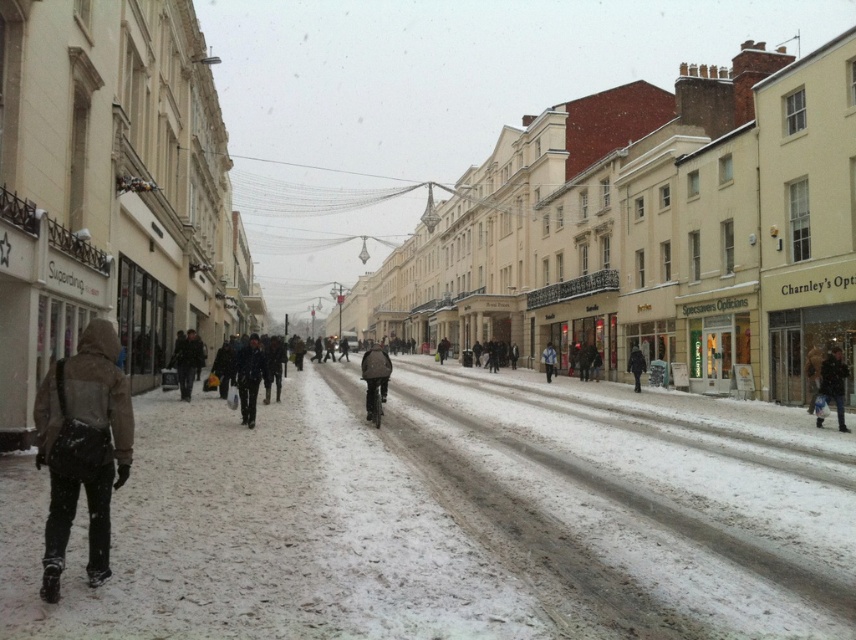
Question: Among these points, which one is farthest from the camera?

Choices:
 (A) (253, 401)
 (B) (548, 380)
 (C) (605, 456)

Answer: (B)

Question: Which point is farther to the camera?

Choices:
 (A) (45, 525)
 (B) (633, 353)
 (C) (825, 396)
 (D) (397, 618)

Answer: (B)

Question: Can you confirm if dark brown leather jacket at center is positioned below dark blue jacket at right?

Choices:
 (A) no
 (B) yes

Answer: (B)

Question: Is dark gray jacket at center further to the viewer compared to dark blue jacket at right?

Choices:
 (A) no
 (B) yes

Answer: (A)

Question: Can you confirm if dark blue jacket at right is thinner than blue denim jacket at center?

Choices:
 (A) yes
 (B) no

Answer: (A)

Question: Based on their relative distances, which object is farther from the dark gray jacket at center?

Choices:
 (A) dark blue jacket at right
 (B) dark gray coat at center
 (C) brown fuzzy jacket at left
 (D) white powdery snow at lower left

Answer: (B)